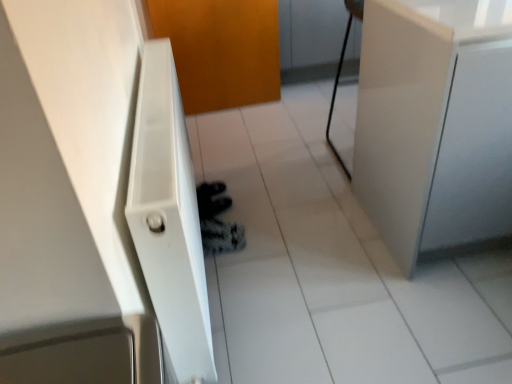
Question: Based on their positions, is white glossy cabinet at right located to the left or right of white glossy tile at center?

Choices:
 (A) right
 (B) left

Answer: (A)

Question: Is white glossy cabinet at right bigger or smaller than white glossy tile at center?

Choices:
 (A) small
 (B) big

Answer: (B)

Question: Estimate the real-world distances between objects in this image. Which object is closer to the white glossy cabinet at right?

Choices:
 (A) white textured radiator at left
 (B) orange matte door at center
 (C) white glossy tile at center

Answer: (C)

Question: Considering the real-world distances, which object is closest to the white glossy cabinet at right?

Choices:
 (A) white textured radiator at left
 (B) orange matte door at center
 (C) white glossy tile at center

Answer: (C)